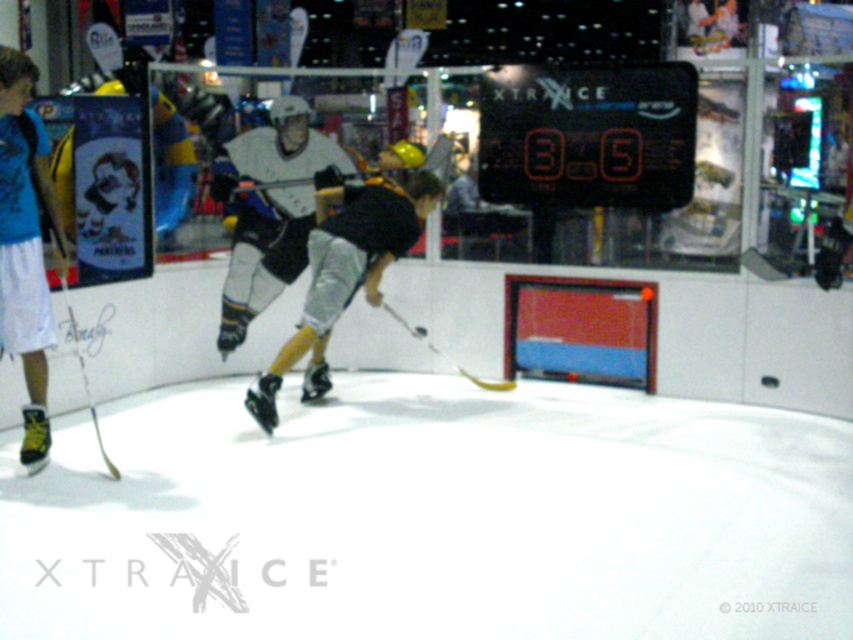
Can you confirm if white matte hockey stick at center is smaller than yellow matte hockey stick at center?

No.

Which is in front, point (270, 177) or point (384, 305)?

Point (270, 177)

Is point (277, 150) less distant than point (463, 376)?

Yes, it is in front of point (463, 376).

The image size is (853, 640). What are the coordinates of `white matte hockey stick at center` in the screenshot? It's located at (270, 209).

Between point (477, 605) and point (53, 224), which one is positioned in front?

Point (477, 605) is in front.

Based on the photo, who is positioned more to the right, white smooth ice at center or blue fabric shorts at left?

white smooth ice at center

Which is in front, point (579, 432) or point (35, 72)?

Point (35, 72) is more forward.

At what (x,y) coordinates should I click in order to perform the action: click on white smooth ice at center. Please return your answer as a coordinate pair (x, y). The image size is (853, 640). Looking at the image, I should click on (433, 518).

Can you confirm if black plastic scoreboard at upper center is positioned below yellow matte hockey stick at center?

A: Actually, black plastic scoreboard at upper center is above yellow matte hockey stick at center.

Does black plastic scoreboard at upper center have a greater width compared to yellow matte hockey stick at center?

Correct, the width of black plastic scoreboard at upper center exceeds that of yellow matte hockey stick at center.

Who is more distant from viewer, (508, 145) or (426, 346)?

Point (426, 346)

Where is `black plastic scoreboard at upper center`? The height and width of the screenshot is (640, 853). black plastic scoreboard at upper center is located at coordinates (589, 134).